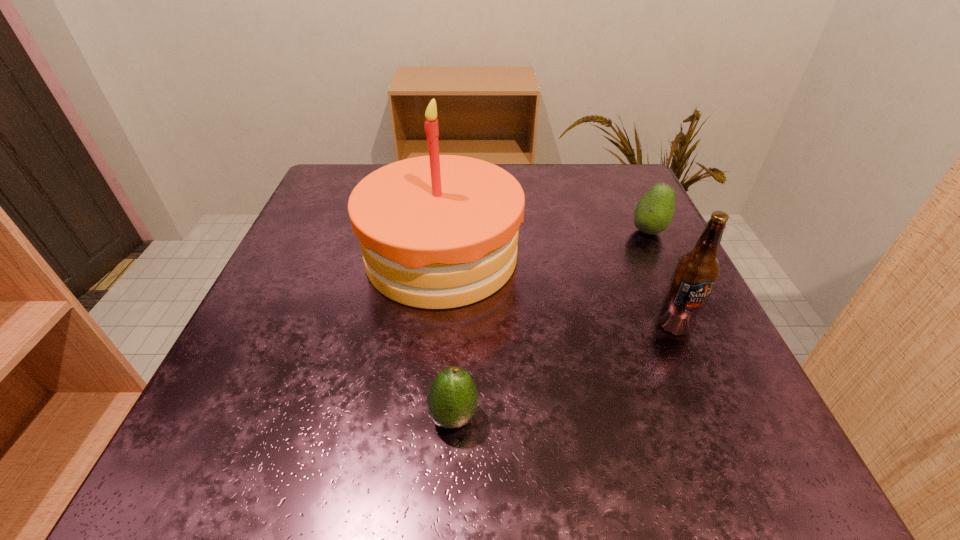
Locate an element on the screen. The height and width of the screenshot is (540, 960). object situated at the near edge is located at coordinates (452, 397).

At what (x,y) coordinates should I click in order to perform the action: click on object situated at the left edge. Please return your answer as a coordinate pair (x, y). Image resolution: width=960 pixels, height=540 pixels. Looking at the image, I should click on (441, 231).

In order to click on beer bottle that is at the right edge in this screenshot , I will do `click(696, 273)`.

At what (x,y) coordinates should I click in order to perform the action: click on avocado that is at the right edge. Please return your answer as a coordinate pair (x, y). Looking at the image, I should click on (654, 212).

I want to click on object that is positioned at the far left corner, so click(441, 231).

In the image, there is a desktop. Where is `free space at the near edge`? The image size is (960, 540). free space at the near edge is located at coordinates (504, 485).

Where is `vacant space at the left edge`? The height and width of the screenshot is (540, 960). vacant space at the left edge is located at coordinates (327, 313).

This screenshot has height=540, width=960. What are the coordinates of `blank space at the right edge` in the screenshot? It's located at (681, 406).

The image size is (960, 540). What are the coordinates of `vacant space at the near left corner of the desktop` in the screenshot? It's located at (171, 475).

At what (x,y) coordinates should I click in order to perform the action: click on vacant space at the far right corner of the desktop. Please return your answer as a coordinate pair (x, y). Looking at the image, I should click on (606, 168).